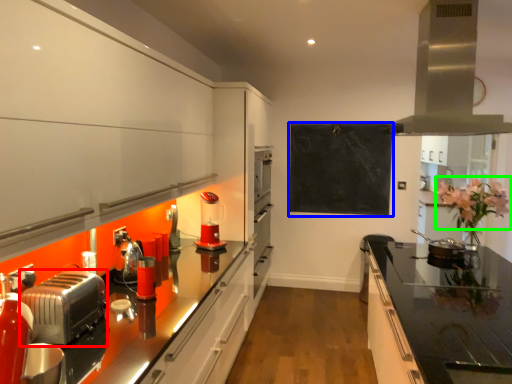
Question: Based on their relative distances, which object is farther from toaster (highlighted by a red box)? Choose from bulletin board (highlighted by a blue box) and flower (highlighted by a green box).

Choices:
 (A) bulletin board
 (B) flower

Answer: (A)